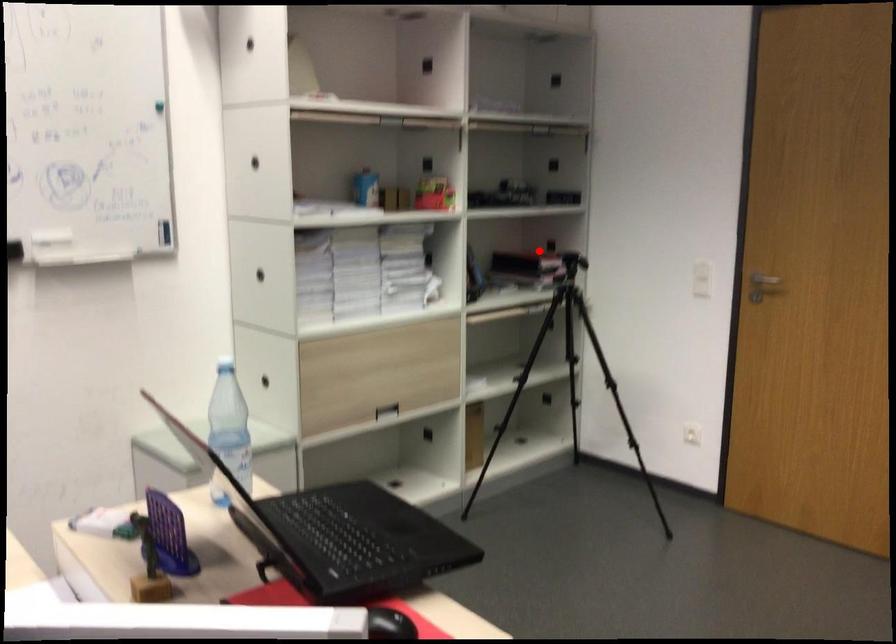
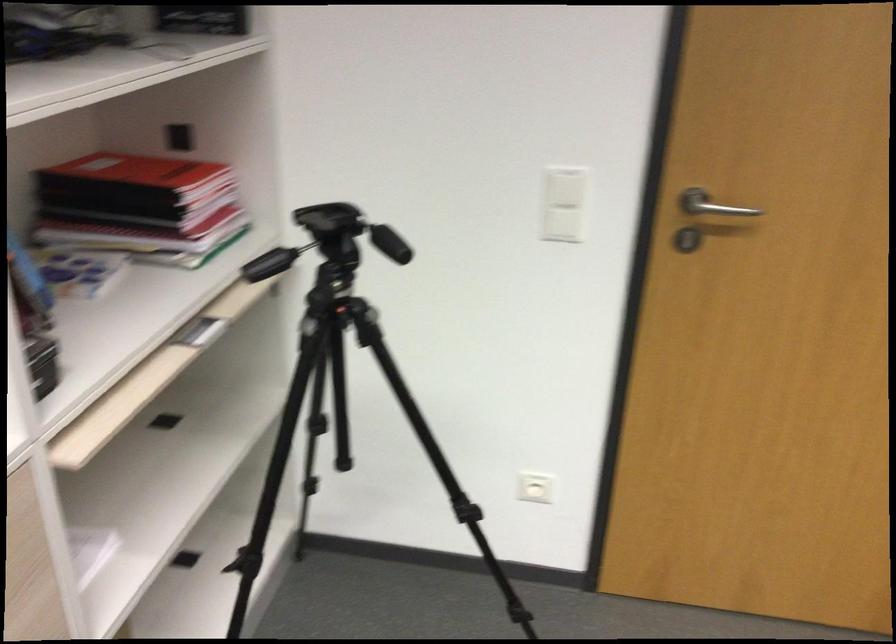
Question: I am providing you with two images of the same scene from different viewpoints. A red point is marked on the first image. Can you still see the location of the red point in image 2?

Choices:
 (A) Yes
 (B) No

Answer: (A)